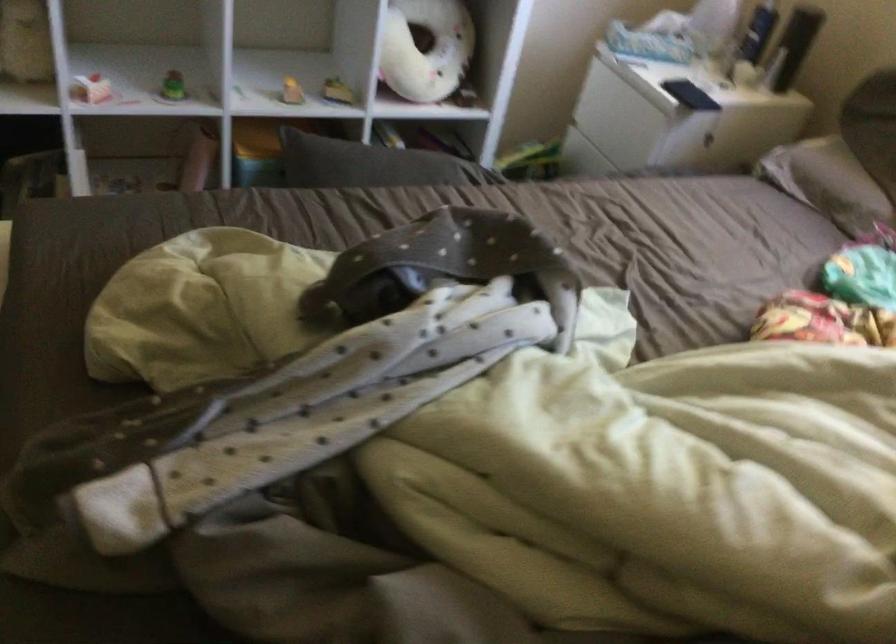
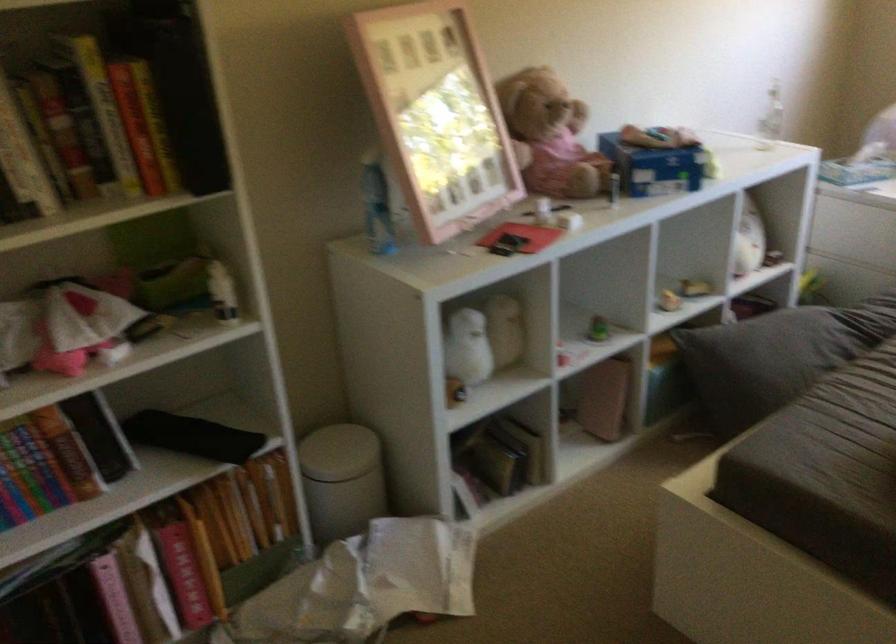
In the second image, find the point that corresponds to (x=341, y=182) in the first image.

(776, 357)